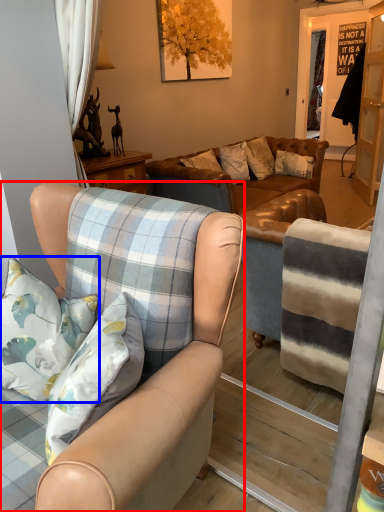
Question: Among these objects, which one is nearest to the camera, chair (highlighted by a red box) or pillow (highlighted by a blue box)?

Choices:
 (A) chair
 (B) pillow

Answer: (A)